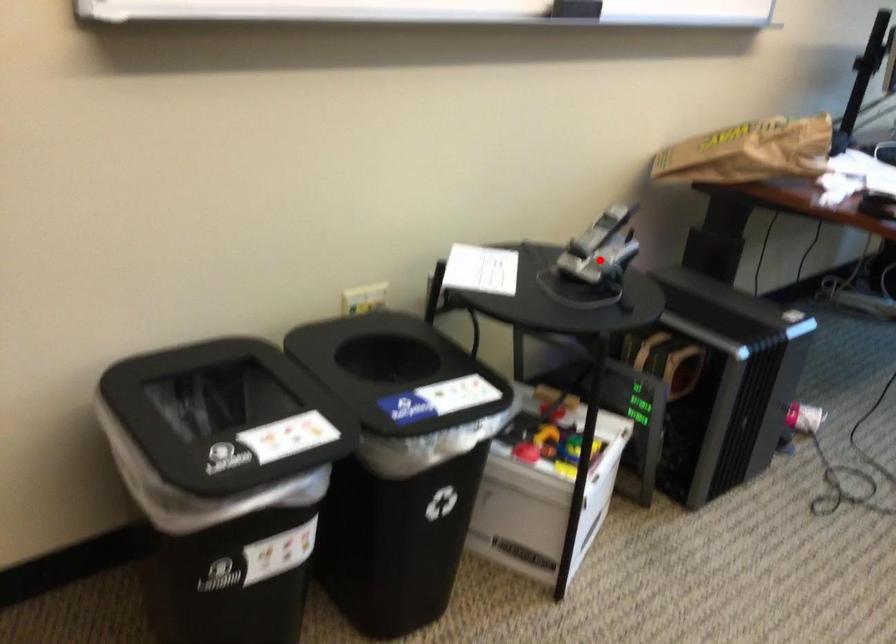
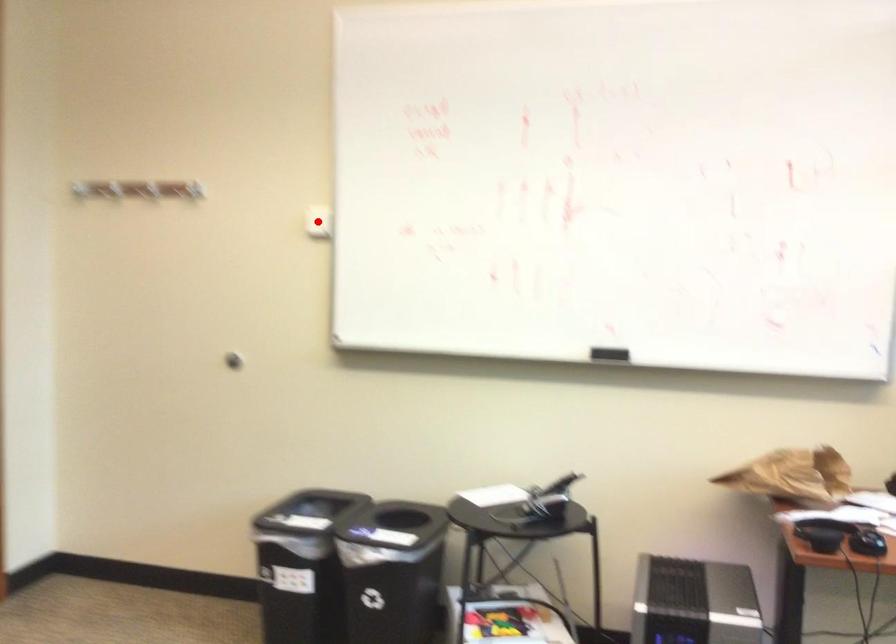
I am providing you with two images of the same scene from different viewpoints. A red point is marked on the first image and another point is marked on the second image. Is the red point in image1 aligned with the point shown in image2?

No